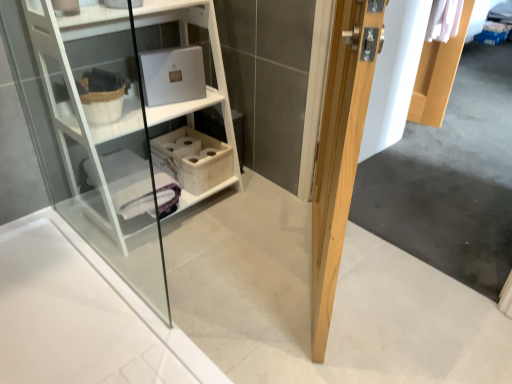
Identify the location of natural wood door at right. (340, 149).

Describe the element at coordinates (340, 149) in the screenshot. This screenshot has height=384, width=512. I see `natural wood door at right` at that location.

Consider the image. In order to face white woven basket at center, should I rotate leftwards or rightwards?

You should rotate left by 8.270 degrees.

Image resolution: width=512 pixels, height=384 pixels. What do you see at coordinates (194, 159) in the screenshot?
I see `white woven basket at center` at bounding box center [194, 159].

This screenshot has height=384, width=512. In order to click on white wood shelf at upper left in this screenshot , I will do `click(206, 87)`.

Is white wood shelf at upper left directly adjacent to natural wood door at right?

white wood shelf at upper left and natural wood door at right are clearly separated.

Choose the correct answer: Is white wood shelf at upper left inside natural wood door at right or outside it?

The correct answer is: outside.

From a real-world perspective, is white wood shelf at upper left on natural wood door at right?

No, from a real-world perspective, white wood shelf at upper left is not above natural wood door at right.

From the picture: Which of these two, white wood shelf at upper left or natural wood door at right, is wider?

Wider between the two is white wood shelf at upper left.

Which point is more forward, (72, 22) or (187, 129)?

The point (72, 22) is closer to the camera.

How many degrees apart are the facing directions of white wood shelf at upper left and white woven basket at center?

They differ by 0.284 degrees in their facing directions.

Which is more to the left, white wood shelf at upper left or white woven basket at center?

Positioned to the left is white wood shelf at upper left.

From the image's perspective, relative to white woven basket at center, is white wood shelf at upper left above or below?

Answer: From the image's perspective, white wood shelf at upper left appears above white woven basket at center.

Considering the points (377, 8) and (86, 33), which point is in front, point (377, 8) or point (86, 33)?

The point (377, 8) is closer.

Locate an element on the screen. Image resolution: width=512 pixels, height=384 pixels. door that appears on the right of white wood shelf at upper left is located at coordinates (340, 149).

In terms of height, does natural wood door at right look taller or shorter compared to white wood shelf at upper left?

natural wood door at right is taller than white wood shelf at upper left.

Could you tell me if natural wood door at right is facing white wood shelf at upper left?

No, natural wood door at right is not aimed at white wood shelf at upper left.

Which of these two, white woven basket at center or natural wood door at right, stands shorter?

white woven basket at center is shorter.

From a real-world perspective, does white woven basket at center sit lower than natural wood door at right?

Yes, from a real-world perspective, white woven basket at center is under natural wood door at right.

From the image's perspective, is white woven basket at center positioned above or below natural wood door at right?

white woven basket at center is above natural wood door at right.

Is white woven basket at center oriented away from natural wood door at right?

No, white woven basket at center is not facing away from natural wood door at right.

At what (x,y) coordinates should I click in order to perform the action: click on basket behind the white wood shelf at upper left. Please return your answer as a coordinate pair (x, y). Looking at the image, I should click on (194, 159).

Is white woven basket at center not close to white wood shelf at upper left?

No, white woven basket at center is in close proximity to white wood shelf at upper left.

Considering the relative sizes of white woven basket at center and white wood shelf at upper left in the image provided, is white woven basket at center thinner than white wood shelf at upper left?

Yes.

Between white woven basket at center and white wood shelf at upper left, which one is positioned behind?

white woven basket at center is further from the camera.

What are the coordinates of `door located above the white woven basket at center (from a real-world perspective)` in the screenshot? It's located at (340, 149).

Between natural wood door at right and white woven basket at center, which one has smaller width?

natural wood door at right is thinner.

In the scene shown: Who is smaller, natural wood door at right or white woven basket at center?

Smaller between the two is white woven basket at center.

Does natural wood door at right turn towards white woven basket at center?

No.

Identify the location of shelf that is behind the natural wood door at right. (206, 87).

Find the location of a particular element. This screenshot has height=384, width=512. shelf that is above the white woven basket at center (from the image's perspective) is located at coordinates (206, 87).

Estimate the real-world distances between objects in this image. Which object is further from natural wood door at right, white woven basket at center or white wood shelf at upper left?

white wood shelf at upper left.

Which object lies nearer to the anchor point natural wood door at right, white wood shelf at upper left or white woven basket at center?

The object closer to natural wood door at right is white woven basket at center.

From the image, which object appears to be nearer to white woven basket at center, natural wood door at right or white wood shelf at upper left?

white wood shelf at upper left is closer to white woven basket at center.

Looking at the image, which one is located further to white wood shelf at upper left, white woven basket at center or natural wood door at right?

Among the two, natural wood door at right is located further to white wood shelf at upper left.

Based on their spatial positions, is white wood shelf at upper left or natural wood door at right further from white woven basket at center?

Among the two, natural wood door at right is located further to white woven basket at center.

Considering their positions, is natural wood door at right positioned further to white wood shelf at upper left than white woven basket at center?

Based on the image, natural wood door at right appears to be further to white wood shelf at upper left.

Locate an element on the screen. The height and width of the screenshot is (384, 512). shelf between natural wood door at right and white woven basket at center from front to back is located at coordinates (206, 87).